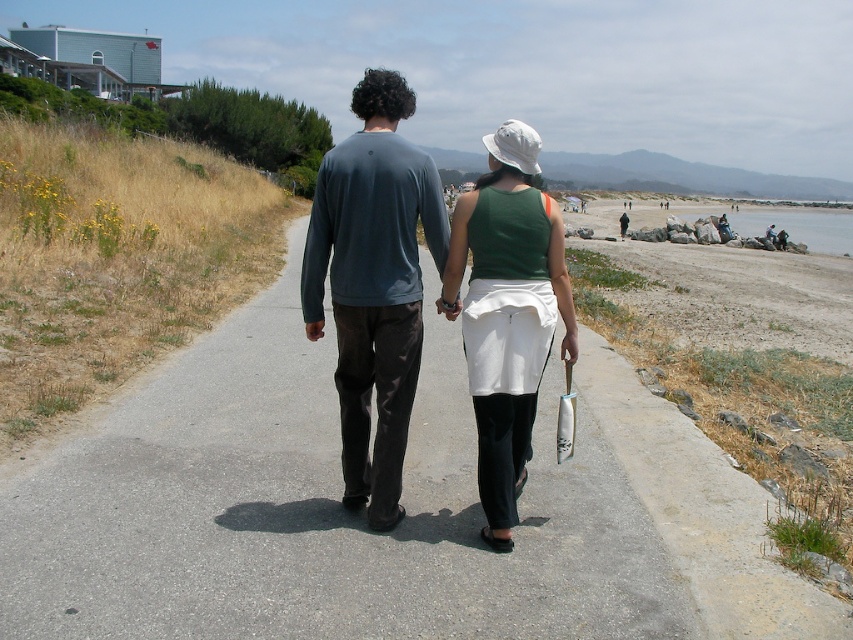
Question: Among these points, which one is nearest to the camera?

Choices:
 (A) (305, 426)
 (B) (338, 216)

Answer: (B)

Question: Does asphalt road at center have a larger size compared to green fabric tank top at center?

Choices:
 (A) yes
 (B) no

Answer: (B)

Question: Which of the following is the closest to the observer?

Choices:
 (A) (219, 392)
 (B) (544, 355)
 (C) (387, 336)

Answer: (B)

Question: Is asphalt road at center smaller than green fabric tank top at center?

Choices:
 (A) yes
 (B) no

Answer: (A)

Question: Considering the relative positions of asphalt road at center and green fabric tank top at center in the image provided, where is asphalt road at center located with respect to green fabric tank top at center?

Choices:
 (A) right
 (B) left

Answer: (B)

Question: Which of these objects is positioned closest to the asphalt road at center?

Choices:
 (A) dark gray sweater at center
 (B) green fabric tank top at center

Answer: (A)